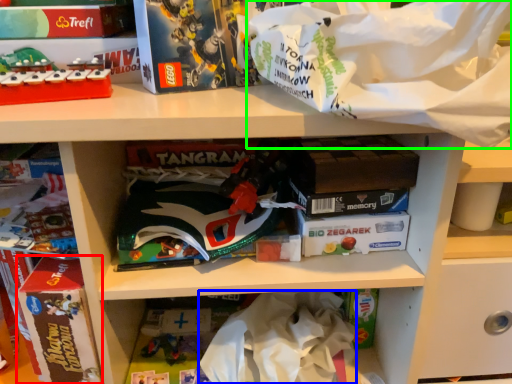
Question: Which object is positioned closest to paperback book (highlighted by a red box)? Select from clothing (highlighted by a blue box) and material (highlighted by a green box).

Choices:
 (A) clothing
 (B) material

Answer: (A)